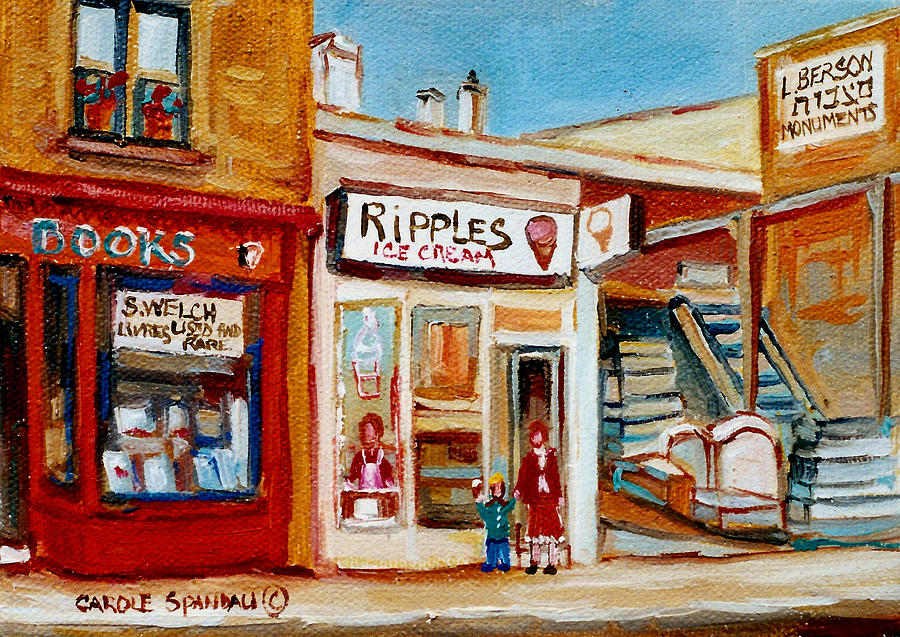
At what (x,y) coordinates should I click in order to perform the action: click on window. Please return your answer as a coordinate pair (x, y). Looking at the image, I should click on click(x=121, y=380).